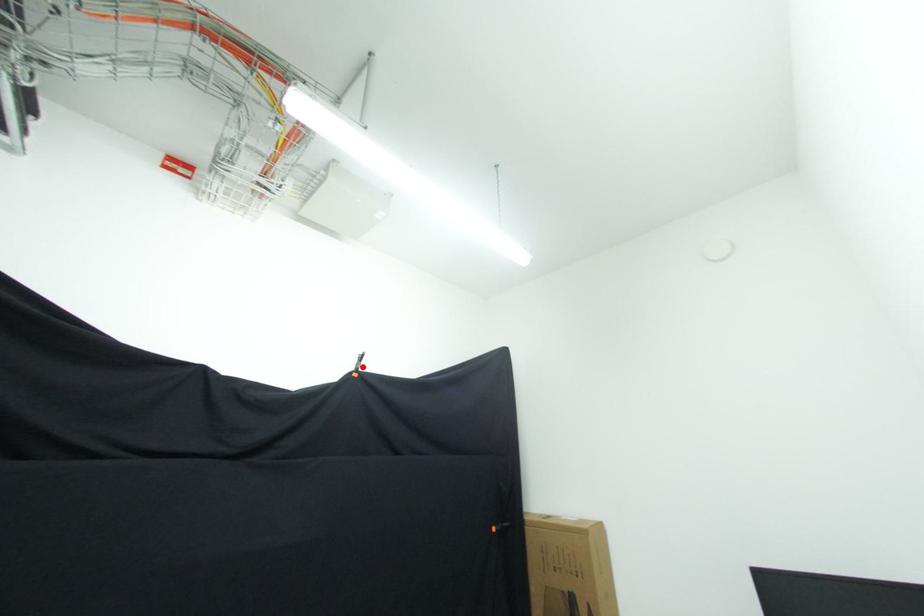
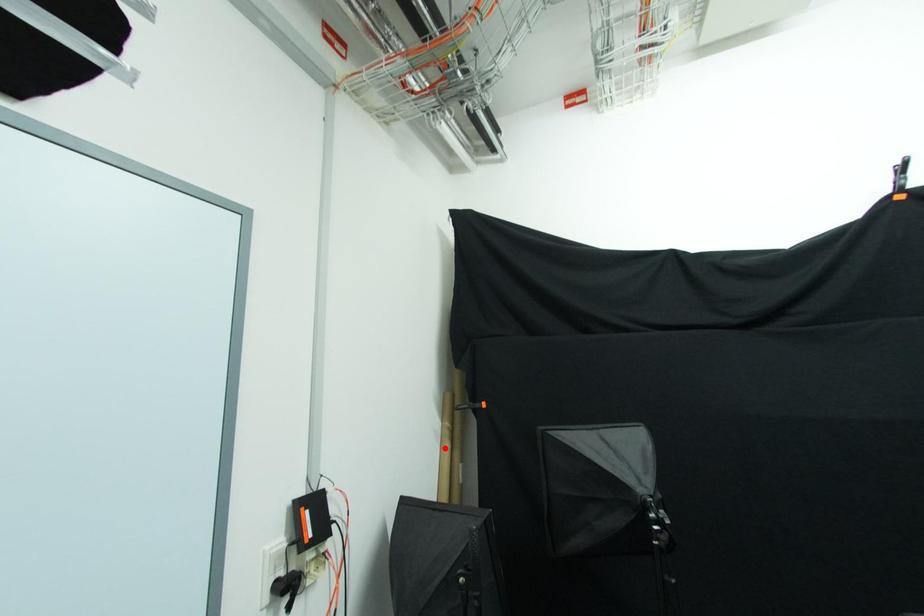
I am providing you with two images of the same scene from different viewpoints. A red point is marked on the first image and another point is marked on the second image. Are the points marked in image1 and image2 representing the same 3D position?

No